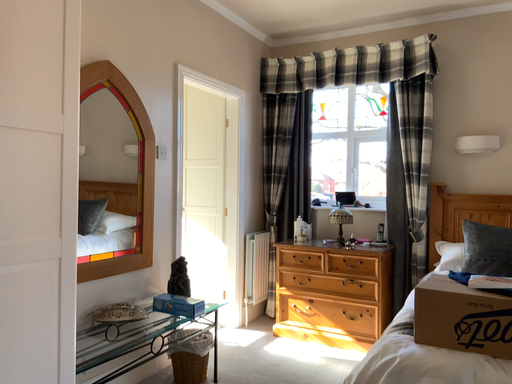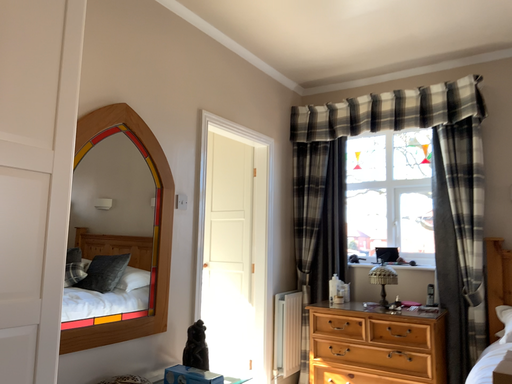
Question: How did the camera likely rotate when shooting the video?

Choices:
 (A) rotated upward
 (B) rotated downward

Answer: (A)